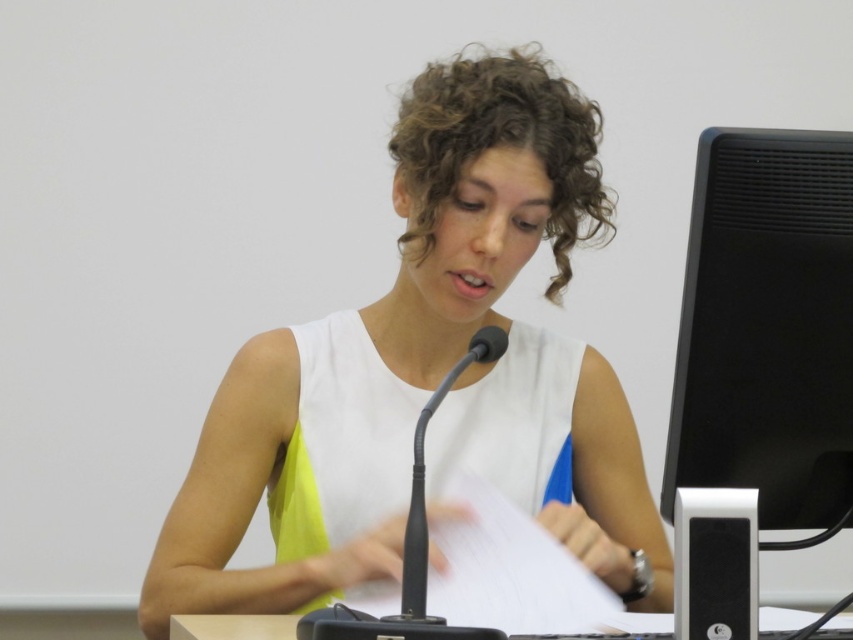
Is point (448, 115) behind point (416, 593)?

That is True.

Does white matte dress at center appear over black plastic microphone at center?

Yes, white matte dress at center is above black plastic microphone at center.

Who is more distant from viewer, (619,429) or (405,595)?

Point (619,429)

Find the location of `white matte dress at center`. white matte dress at center is located at coordinates (426, 374).

Who is lower down, white matte dress at center or black matte computer monitor at right?

white matte dress at center is lower down.

Is white matte dress at center taller than black matte computer monitor at right?

Yes, white matte dress at center is taller than black matte computer monitor at right.

Does point (438, 444) lie in front of point (717, 397)?

No, it is behind (717, 397).

Locate an element on the screen. Image resolution: width=853 pixels, height=640 pixels. white matte dress at center is located at coordinates (426, 374).

Is black plastic microphone at center positioned at the back of white plastic table at lower center?

No, black plastic microphone at center is in front of white plastic table at lower center.

Locate an element on the screen. The image size is (853, 640). black plastic microphone at center is located at coordinates (422, 476).

Describe the element at coordinates (422, 476) in the screenshot. This screenshot has height=640, width=853. I see `black plastic microphone at center` at that location.

Where is `black plastic microphone at center`? The width and height of the screenshot is (853, 640). black plastic microphone at center is located at coordinates (422, 476).